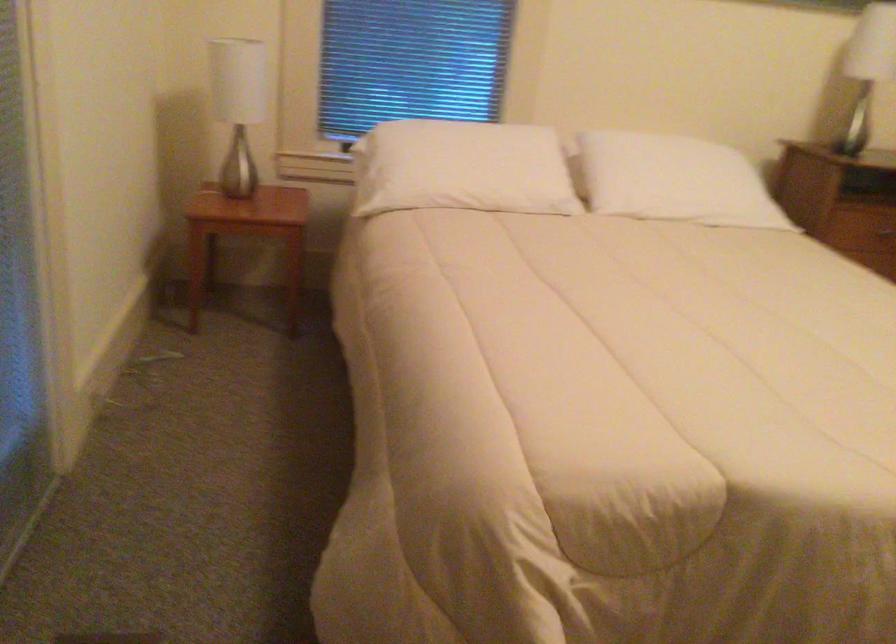
Image resolution: width=896 pixels, height=644 pixels. Find the location of `silver table lamp`. silver table lamp is located at coordinates (238, 106).